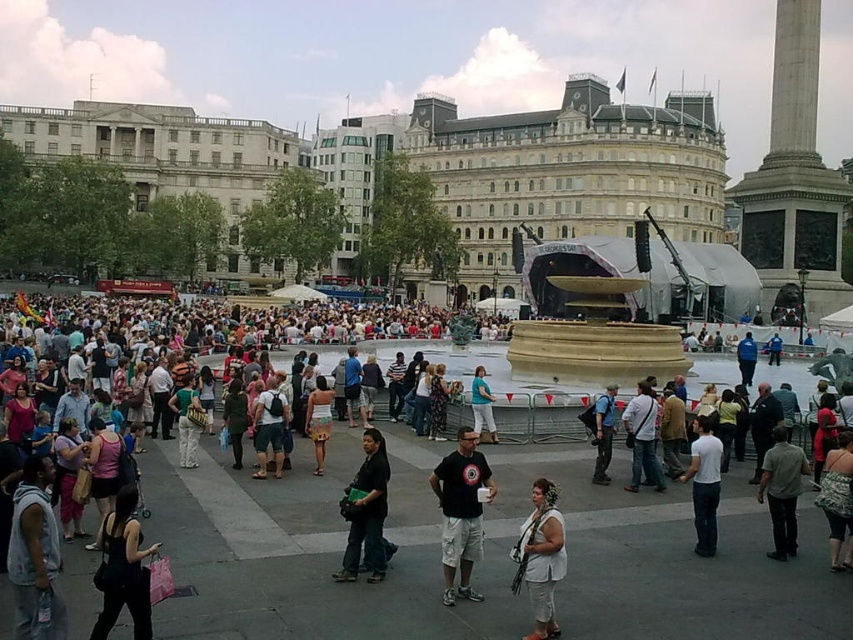
Does light gray hoodie at lower left have a smaller size compared to green textured dress at center?

Incorrect, light gray hoodie at lower left is not smaller in size than green textured dress at center.

Which is behind, point (25, 465) or point (838, 509)?

The point (838, 509) is behind.

This screenshot has height=640, width=853. Identify the location of light gray hoodie at lower left. (35, 556).

I want to click on light gray hoodie at lower left, so click(x=35, y=556).

Who is positioned more to the left, dark green fabric bag at center or matte blue shirt at center?

dark green fabric bag at center

Does dark green fabric bag at center appear on the left side of matte blue shirt at center?

Yes, dark green fabric bag at center is to the left of matte blue shirt at center.

Find the location of a particular element. dark green fabric bag at center is located at coordinates (366, 513).

Find the location of a particular element. This screenshot has width=853, height=640. dark green fabric bag at center is located at coordinates (366, 513).

Can you confirm if beige textured skirt at center is shorter than matte blue shirt at center?

No.

Is point (320, 419) positioned behind point (488, 424)?

No, (320, 419) is in front of (488, 424).

The image size is (853, 640). What do you see at coordinates (318, 419) in the screenshot? I see `beige textured skirt at center` at bounding box center [318, 419].

You are a GUI agent. You are given a task and a screenshot of the screen. Output one action in this format:
    pyautogui.click(x=<x>, y=<y>)
    Task: Click on the beige textured skirt at center
    This screenshot has height=640, width=853.
    Given the screenshot: What is the action you would take?
    pyautogui.click(x=318, y=419)